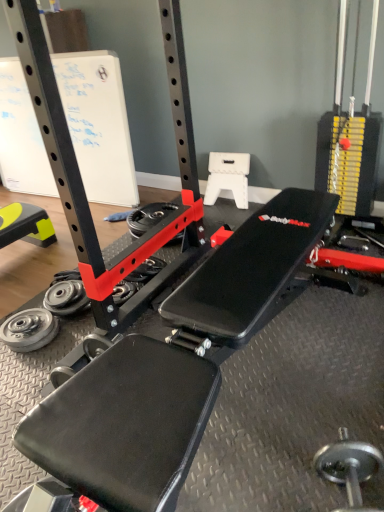
I want to click on vacant space in front of yellow rubber mat at lower left, so click(23, 276).